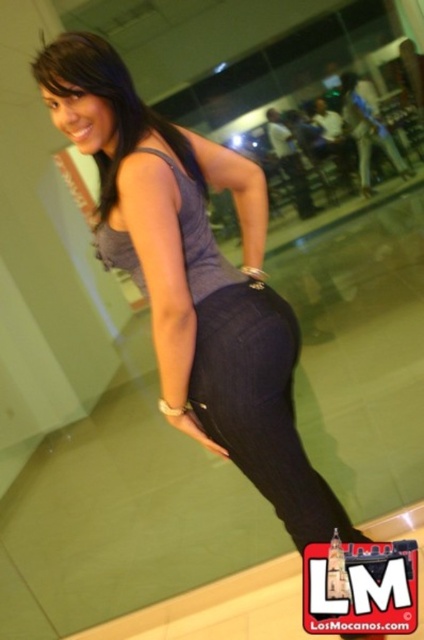
Who is taller, matte purple tank top at upper center or matte gray tank top at center?

Standing taller between the two is matte purple tank top at upper center.

Looking at this image, does matte purple tank top at upper center have a greater width compared to matte gray tank top at center?

Yes, matte purple tank top at upper center is wider than matte gray tank top at center.

Between point (128, 72) and point (198, 246), which one is positioned in front?

Point (198, 246)

I want to click on matte purple tank top at upper center, so click(x=108, y=104).

Which is behind, point (178, 131) or point (298, 204)?

The point (298, 204) is more distant.

Between point (31, 68) and point (276, 124), which one is positioned behind?

The point (276, 124) is more distant.

Find the location of a particular element. The image size is (424, 640). matte purple tank top at upper center is located at coordinates (108, 104).

Is point (175, 172) closer to viewer compared to point (296, 147)?

Yes, it is in front of point (296, 147).

Measure the distance between point (184,236) and camera.

1.27 meters

This screenshot has width=424, height=640. What are the coordinates of `matte gray tank top at center` in the screenshot? It's located at (198, 237).